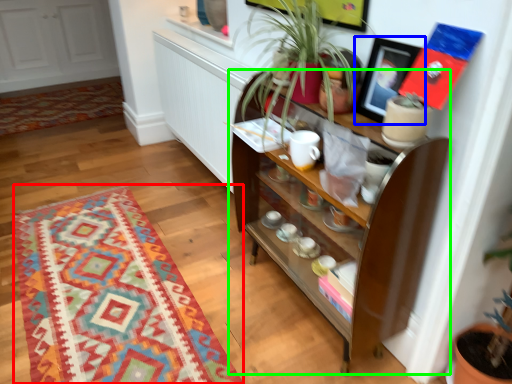
Question: Based on their relative distances, which object is nearer to mat (highlighted by a red box)? Choose from picture frame (highlighted by a blue box) and shelf (highlighted by a green box).

Choices:
 (A) picture frame
 (B) shelf

Answer: (B)